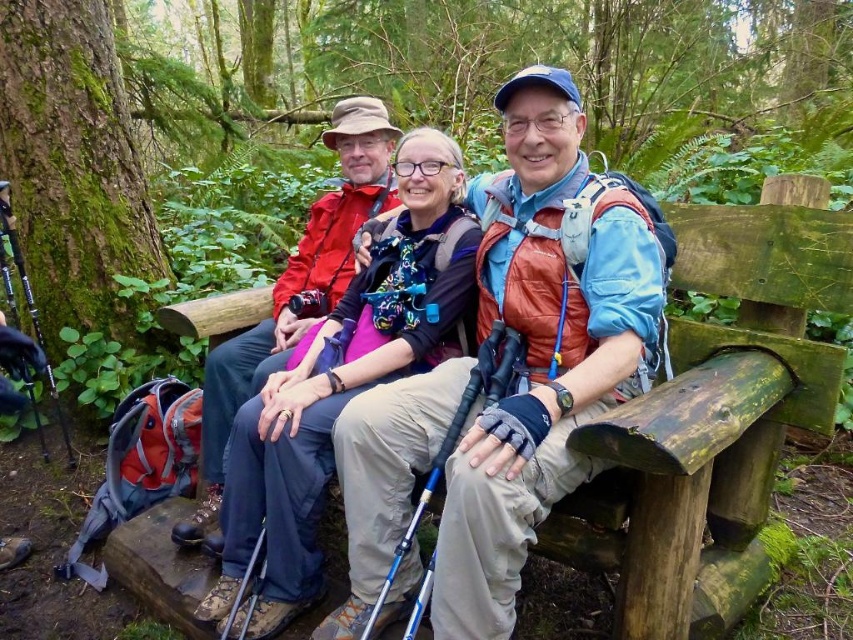
Can you confirm if weathered wood bench at center is taller than matte purple jacket at center?

Incorrect, weathered wood bench at center's height is not larger of matte purple jacket at center's.

Who is more distant from viewer, [643,586] or [469,262]?

Positioned behind is point [469,262].

Does point (689, 275) come farther from viewer compared to point (287, 604)?

Yes.

The width and height of the screenshot is (853, 640). What are the coordinates of `weathered wood bench at center` in the screenshot? It's located at (715, 412).

Between point (457, 620) and point (402, 195), which one is positioned behind?

Positioned behind is point (402, 195).

Is point (546, 273) farther from camera compared to point (381, 236)?

No, (546, 273) is in front of (381, 236).

Where is `matte blue jacket at center`? Image resolution: width=853 pixels, height=640 pixels. matte blue jacket at center is located at coordinates (541, 348).

Is matte blue jacket at center smaller than weathered wood bench at center?

No, matte blue jacket at center is not smaller than weathered wood bench at center.

Does matte blue jacket at center have a lesser height compared to weathered wood bench at center?

No.

Is point (590, 291) closer to camera compared to point (689, 486)?

No.

Where is `matte blue jacket at center`? This screenshot has height=640, width=853. matte blue jacket at center is located at coordinates (541, 348).